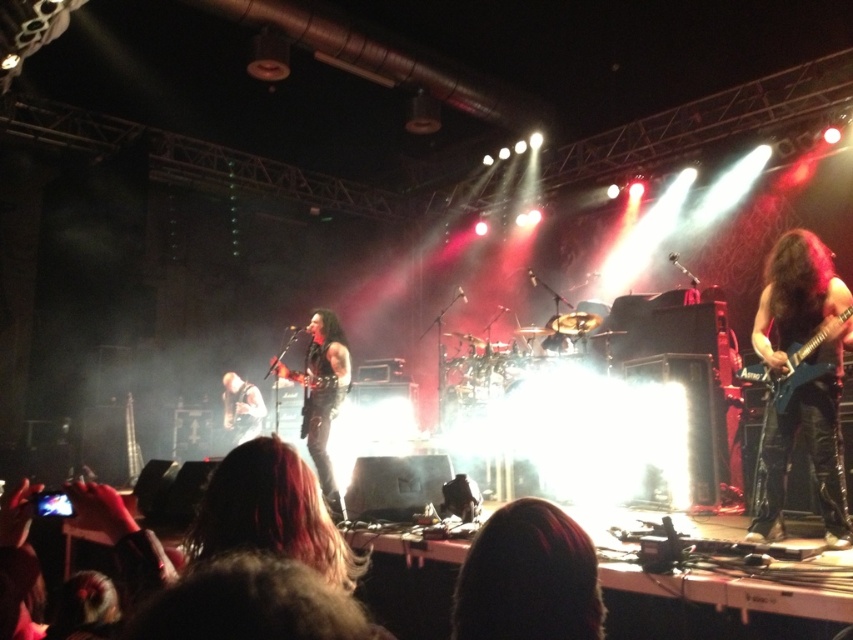
You are a GUI agent. You are given a task and a screenshot of the screen. Output one action in this format:
    pyautogui.click(x=<x>, y=<y>)
    Task: Click on the shiny dark hair at center
    This screenshot has height=640, width=853.
    Given the screenshot: What is the action you would take?
    pos(271,513)

Is shiny dark hair at center shorter than black leather jacket at center?

Yes, shiny dark hair at center is shorter than black leather jacket at center.

You are a GUI agent. You are given a task and a screenshot of the screen. Output one action in this format:
    pyautogui.click(x=<x>, y=<y>)
    Task: Click on the shiny dark hair at center
    This screenshot has width=853, height=640.
    Given the screenshot: What is the action you would take?
    [x=271, y=513]

Is point (485, 589) positioned before point (315, 372)?

Yes, it is in front of point (315, 372).

Does dark brown hair at center have a lesser height compared to shiny black electric guitar at center?

Correct, dark brown hair at center is not as tall as shiny black electric guitar at center.

Which is behind, point (514, 554) or point (288, 371)?

Positioned behind is point (288, 371).

I want to click on dark brown hair at center, so click(527, 577).

Which is in front, point (514, 508) or point (251, 387)?

Point (514, 508)

Who is positioned more to the left, dark brown hair at center or shiny black guitar at center?

shiny black guitar at center is more to the left.

Find the location of a particular element. The height and width of the screenshot is (640, 853). dark brown hair at center is located at coordinates point(527,577).

This screenshot has height=640, width=853. Identify the location of dark brown hair at center. (527, 577).